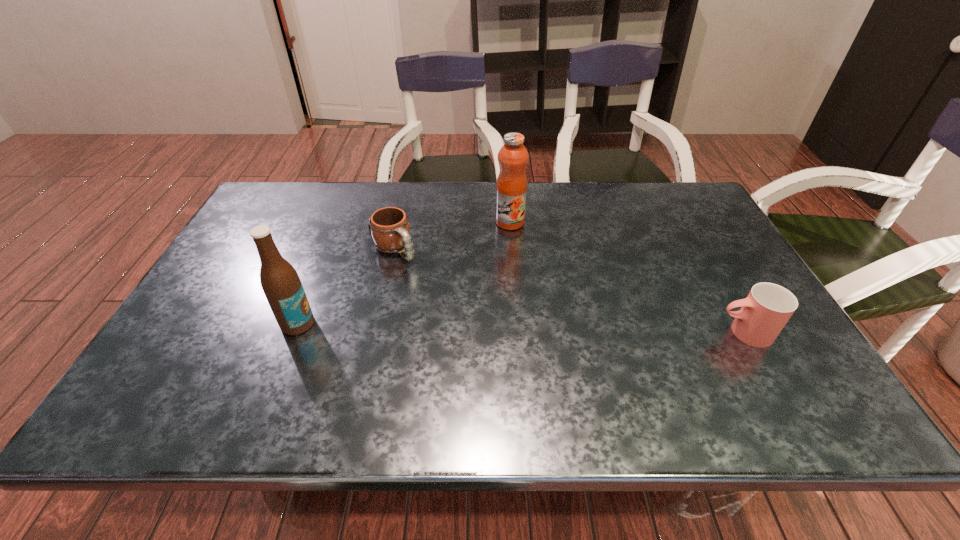
The image size is (960, 540). What are the coordinates of `free space on the desktop that is between the leftmost object and the second shortest object and is positioned on the front label of the farthest object` in the screenshot? It's located at (478, 327).

Identify the location of free space on the desktop that is between the beer bottle and the cup and is positioned on the side of the shortest object with the handle. The image size is (960, 540). (469, 327).